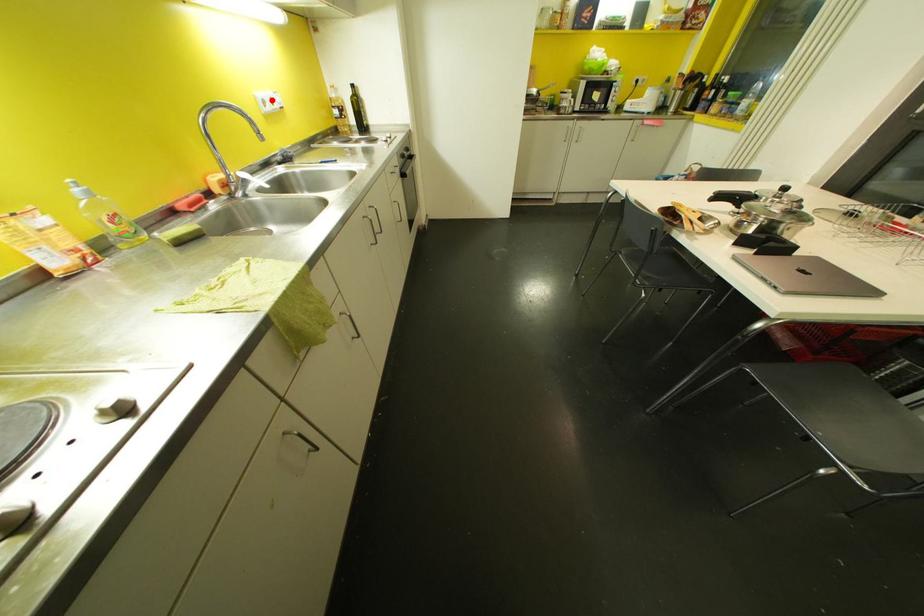
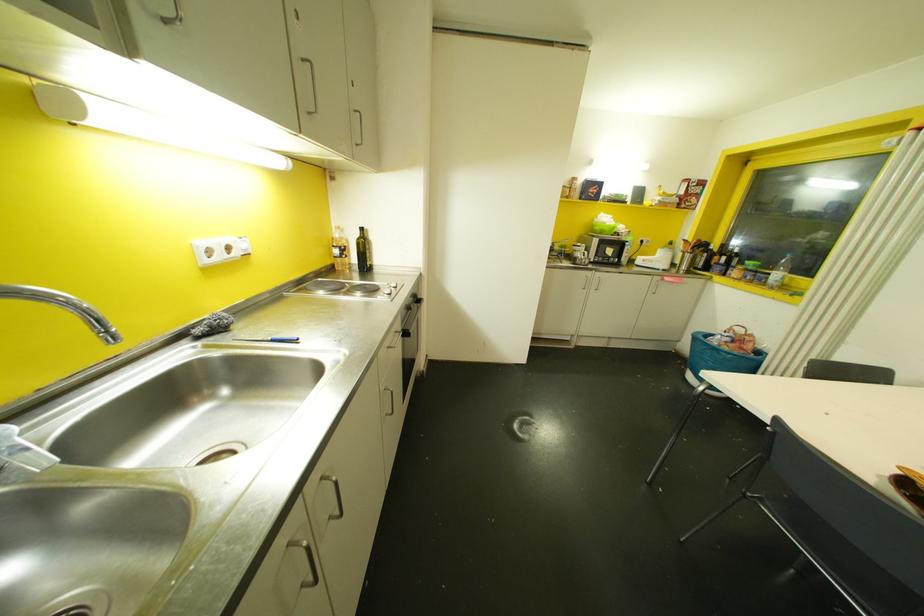
Where in the second image is the point corresponding to the highlighted location from the first image?

(227, 248)